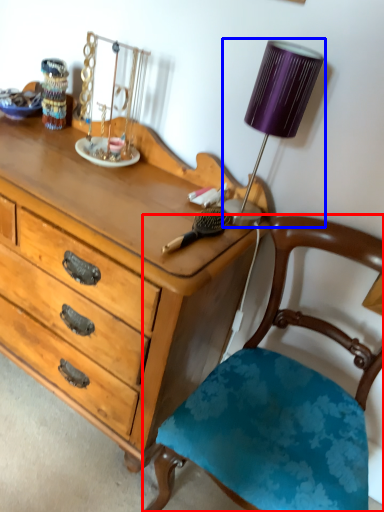
Question: Which of the following is the closest to the observer, chair (highlighted by a red box) or lamp (highlighted by a blue box)?

Choices:
 (A) chair
 (B) lamp

Answer: (A)